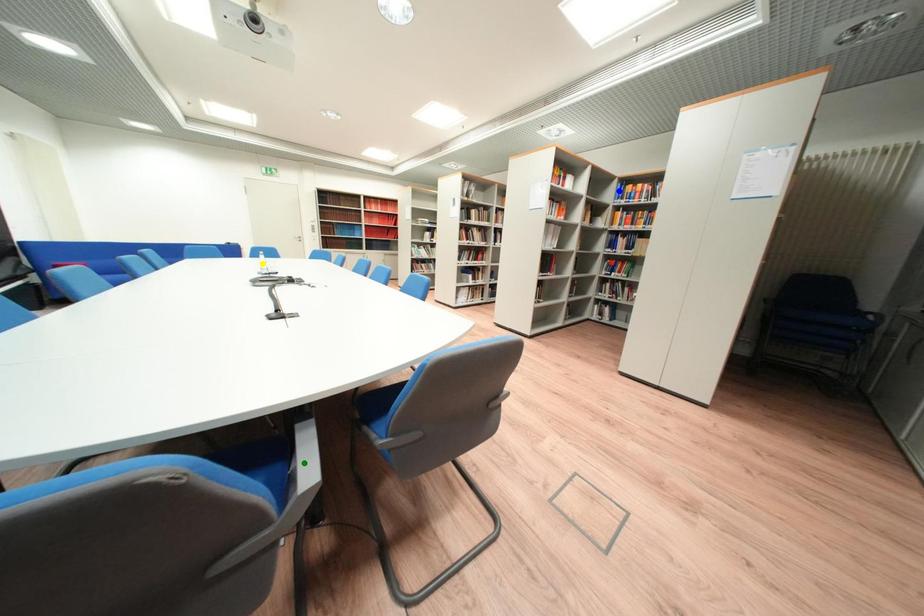
Order these from farthest to nearest:
1. blue point
2. yellow point
3. green point

blue point → yellow point → green point